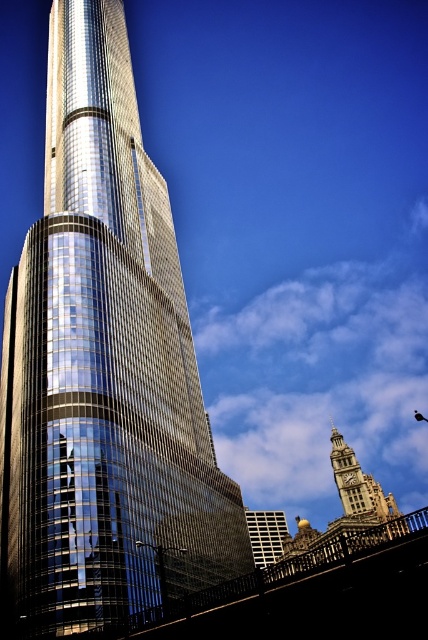
Question: Which of the following is the farthest from the observer?

Choices:
 (A) (74, 212)
 (B) (282, 518)

Answer: (B)

Question: Is shiny glass skyscraper at left positioned behind matte glass building at lower center?

Choices:
 (A) no
 (B) yes

Answer: (A)

Question: Can you confirm if shiny glass skyscraper at left is wider than matte glass building at lower center?

Choices:
 (A) no
 (B) yes

Answer: (B)

Question: Is shiny glass skyscraper at left below matte glass building at lower center?

Choices:
 (A) yes
 (B) no

Answer: (B)

Question: Which point appears closest to the camera in this image?

Choices:
 (A) (18, 310)
 (B) (252, 536)

Answer: (A)